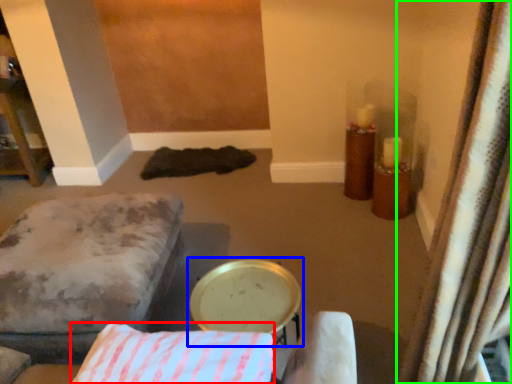
Question: Which object is the farthest from pillow (highlighted by a red box)? Choose among these: round table (highlighted by a blue box) or curtain (highlighted by a green box).

Choices:
 (A) round table
 (B) curtain

Answer: (B)